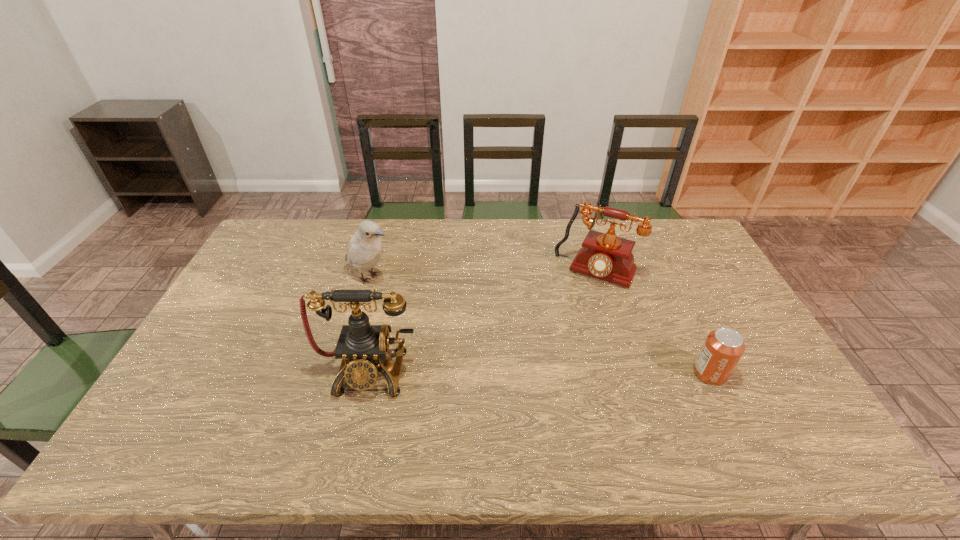
Identify the location of vacant space located 0.130m at the beak of the bird. (421, 300).

At what (x,y) coordinates should I click in order to perform the action: click on vacant space located at the beak of the bird. Please return your answer as a coordinate pair (x, y). Looking at the image, I should click on (439, 309).

Find the location of a particular element. This screenshot has width=960, height=540. vacant point located 0.140m at the beak of the bird is located at coordinates (423, 301).

Find the location of a particular element. Image resolution: width=960 pixels, height=540 pixels. object situated at the far edge is located at coordinates (607, 257).

You are a GUI agent. You are given a task and a screenshot of the screen. Output one action in this format:
    pyautogui.click(x=<x>, y=<y>)
    Task: Click on the object at the near edge
    The image size is (960, 540).
    Given the screenshot: What is the action you would take?
    pyautogui.click(x=362, y=347)

This screenshot has width=960, height=540. Find the location of `object present at the right edge`. object present at the right edge is located at coordinates (723, 348).

The image size is (960, 540). In order to click on vacant space at the far edge of the desktop in this screenshot , I will do `click(516, 227)`.

Find the location of a particular element. free location at the near edge of the desktop is located at coordinates coord(524,416).

Identify the location of vacant space at the left edge. The width and height of the screenshot is (960, 540). (241, 329).

Where is `vacant point at the right edge`? vacant point at the right edge is located at coordinates (770, 368).